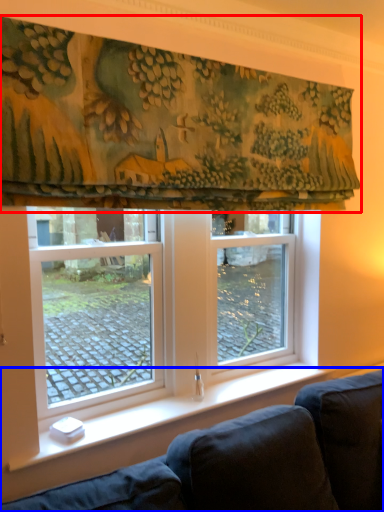
Question: Which object is closer to the camera taking this photo, curtain (highlighted by a red box) or studio couch (highlighted by a blue box)?

Choices:
 (A) curtain
 (B) studio couch

Answer: (A)